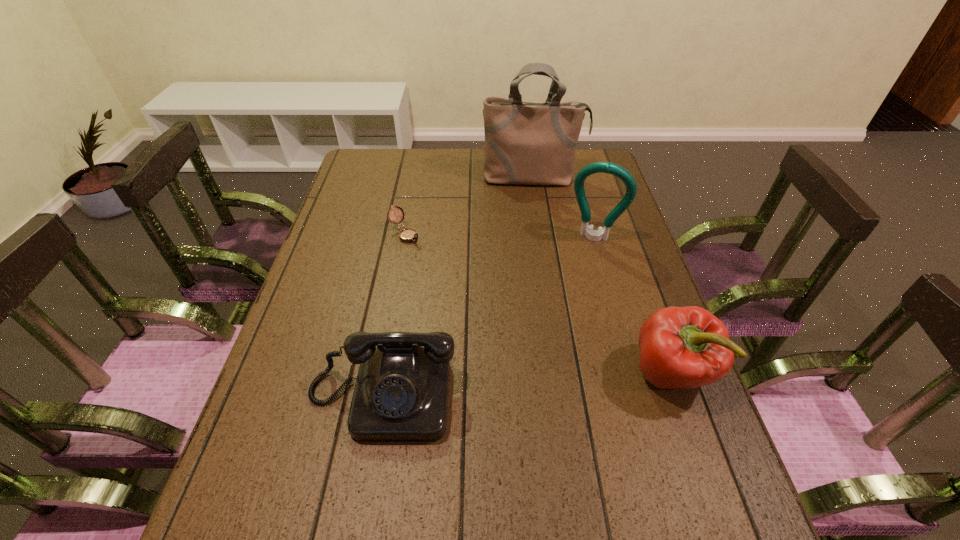
The image size is (960, 540). Identify the location of the fourth tallest object. (401, 393).

The image size is (960, 540). What are the coordinates of `the third shortest object` in the screenshot? It's located at (680, 347).

I want to click on the fourth shortest object, so click(598, 167).

Image resolution: width=960 pixels, height=540 pixels. I want to click on shoulder bag, so click(526, 143).

This screenshot has height=540, width=960. I want to click on the farthest object, so click(x=526, y=143).

The height and width of the screenshot is (540, 960). Identify the location of the shortest object. (407, 235).

Locate an element on the screen. free region located on the dial of the fourth tallest object is located at coordinates (368, 479).

At what (x,y) coordinates should I click in order to perform the action: click on vacant region located on the back of the third tallest object. Please return your answer as a coordinate pair (x, y). This screenshot has height=540, width=960. Looking at the image, I should click on (641, 289).

Locate an element on the screen. This screenshot has width=960, height=540. free space located at the jaws of the bottle opener is located at coordinates (574, 279).

Where is `free space located at the jaws of the bottle opener`? free space located at the jaws of the bottle opener is located at coordinates (576, 274).